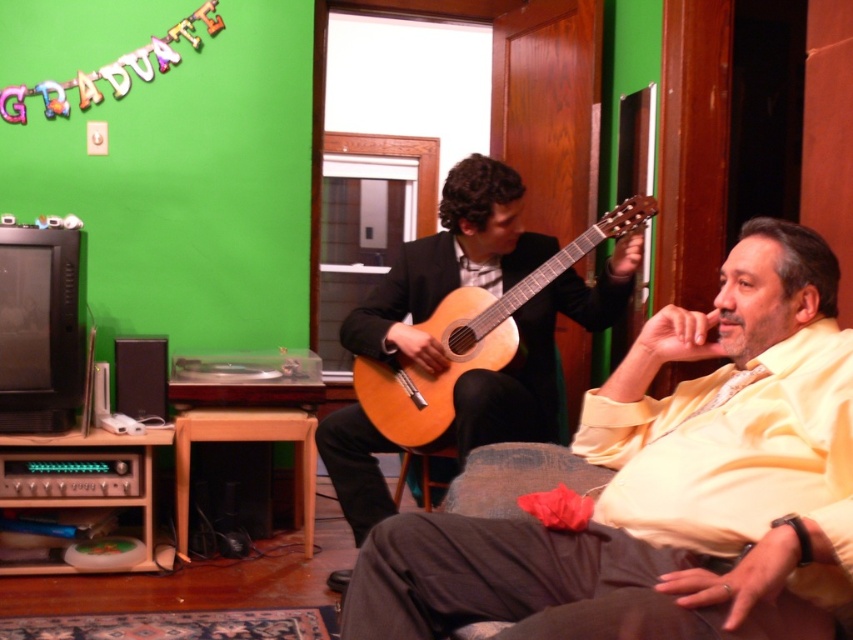
Between light brown wood guitar at center and wooden stool at lower center, which one has more height?

light brown wood guitar at center is taller.

Between light brown wood guitar at center and wooden stool at lower center, which one appears on the right side from the viewer's perspective?

light brown wood guitar at center is more to the right.

Is point (508, 340) in front of point (308, 460)?

That is True.

Find the location of a particular element. The image size is (853, 640). light brown wood guitar at center is located at coordinates (469, 339).

Is point (397, 536) positioned in front of point (399, 413)?

Yes, it is in front of point (399, 413).

Does matte yellow shirt at center have a greater width compared to light brown wood guitar at center?

Yes.

Between point (810, 326) and point (480, 340), which one is positioned in front?

Positioned in front is point (810, 326).

Locate an element on the screen. matte yellow shirt at center is located at coordinates (668, 486).

Can you confirm if matte yellow shirt at center is bigger than wooden stool at lower center?

Correct, matte yellow shirt at center is larger in size than wooden stool at lower center.

Can you confirm if matte yellow shirt at center is taller than wooden stool at lower center?

Correct, matte yellow shirt at center is much taller as wooden stool at lower center.

The width and height of the screenshot is (853, 640). I want to click on matte yellow shirt at center, so click(x=668, y=486).

Where is `matte yellow shirt at center`? matte yellow shirt at center is located at coordinates (668, 486).